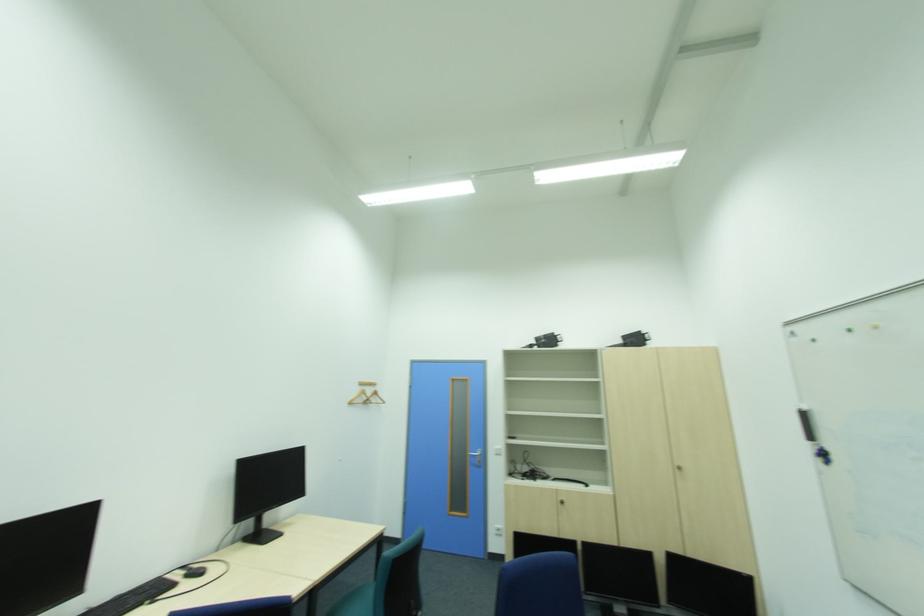
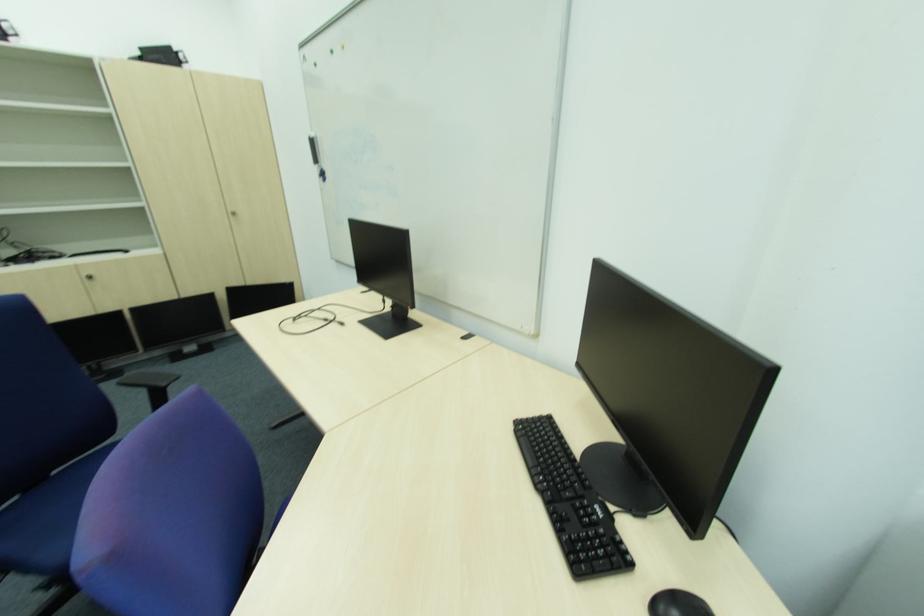
The point at (565, 504) is marked in the first image. Where is the corresponding point in the second image?

(92, 280)